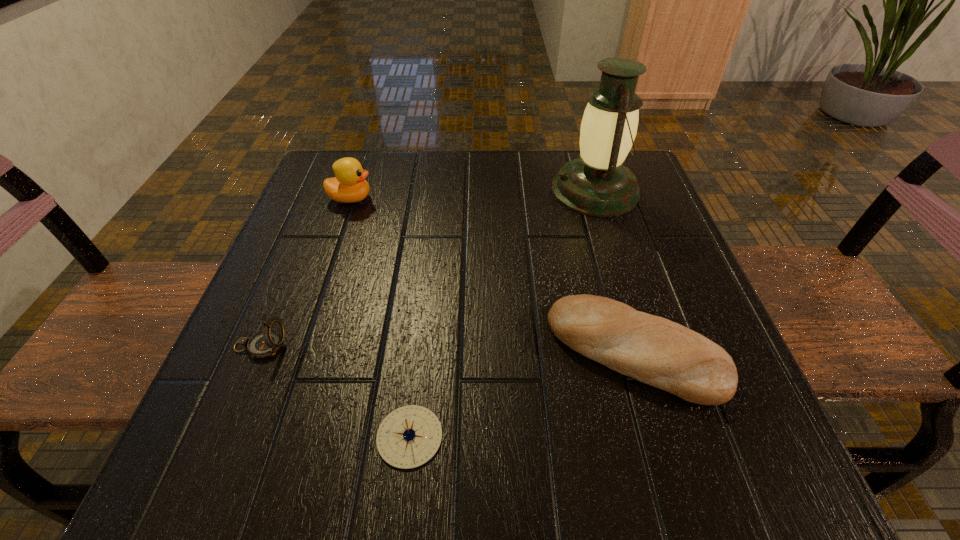
Find the location of a particular element. The height and width of the screenshot is (540, 960). object that can be found as the closest to the taller compass is located at coordinates (408, 437).

At what (x,y) coordinates should I click in order to perform the action: click on free spot that satisfies the following two spatial constraints: 1. on the face of the fourth shortest object; 2. on the back side of the third object from right to left. Please return your answer as a coordinate pair (x, y). The width and height of the screenshot is (960, 540). Looking at the image, I should click on (270, 436).

Locate an element on the screen. free spot that satisfies the following two spatial constraints: 1. on the face of the shortest object; 2. on the right side of the left compass is located at coordinates (223, 436).

Image resolution: width=960 pixels, height=540 pixels. Identify the location of blank area in the image that satisfies the following two spatial constraints: 1. on the back side of the third object from left to right; 2. on the face of the duckling. (437, 199).

Locate an element on the screen. This screenshot has height=540, width=960. vacant area in the image that satisfies the following two spatial constraints: 1. on the face of the left compass; 2. on the right side of the fourth tallest object is located at coordinates (258, 352).

Identify the location of free space that satisfies the following two spatial constraints: 1. on the back side of the bread; 2. on the face of the farther compass. (634, 346).

Where is `vacant space that satisfies the following two spatial constraints: 1. on the face of the fourth shortest object; 2. on the left side of the nearer compass`? The width and height of the screenshot is (960, 540). vacant space that satisfies the following two spatial constraints: 1. on the face of the fourth shortest object; 2. on the left side of the nearer compass is located at coordinates (270, 436).

Find the location of a particular element. free location that satisfies the following two spatial constraints: 1. on the face of the shorter compass; 2. on the left side of the farther compass is located at coordinates tap(223, 436).